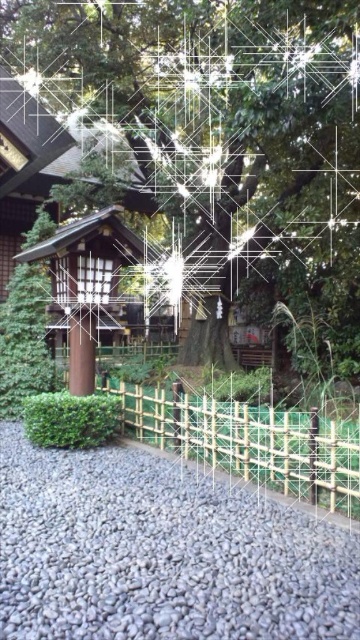
You are standing at the entrance of the garden and see two points marked in the image. The first point is at coordinates point (2,24) and the second is at point (145,417). Which point is closer to you as you face the garden?

Point (2,24) is closer to you because it is further to the viewer than point (145,417).

You are a visitor walking along the gravel path in the Japanese garden. You want to reach the traditional building behind the fence. Which direction should you walk relative to the green bamboo fence at center to stay on the gray gravel at lower center?

The gray gravel at lower center is located below the green bamboo fence at center, so you should walk towards the direction below the green bamboo fence at center to stay on the gray gravel at lower center and reach the traditional building.

You are a gardener who needs to water the green leafy tree at center using a hose that can reach 20 feet. You are currently standing on the gray gravel at lower center. Can you water the tree without moving your position?

The distance between the green leafy tree at center and the gray gravel at lower center is 19.43 feet, which is within the 20 feet reach of the hose. Therefore, you can water the tree without moving from the gray gravel at lower center.